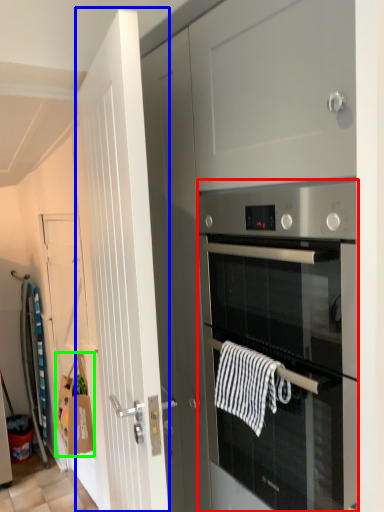
Question: Which object is the farthest from oven (highlighted by a red box)? Choose among these: door (highlighted by a blue box) or hand towel (highlighted by a green box).

Choices:
 (A) door
 (B) hand towel

Answer: (B)